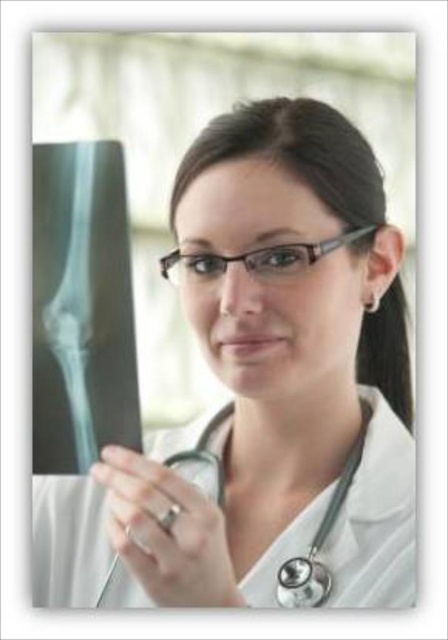
Where is `white matte/x-ray film at center`? Image resolution: width=448 pixels, height=640 pixels. white matte/x-ray film at center is located at coordinates (262, 387).

Which is in front, point (302, 314) or point (185, 467)?

Point (302, 314) is more forward.

The image size is (448, 640). I want to click on white matte/x-ray film at center, so click(x=262, y=387).

Where is `white matte/x-ray film at center`? white matte/x-ray film at center is located at coordinates pos(262,387).